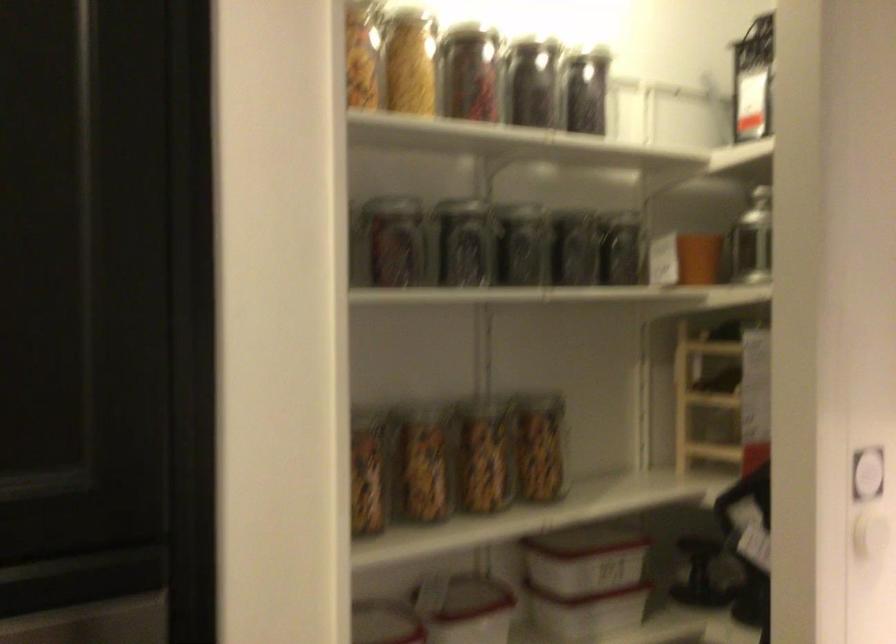
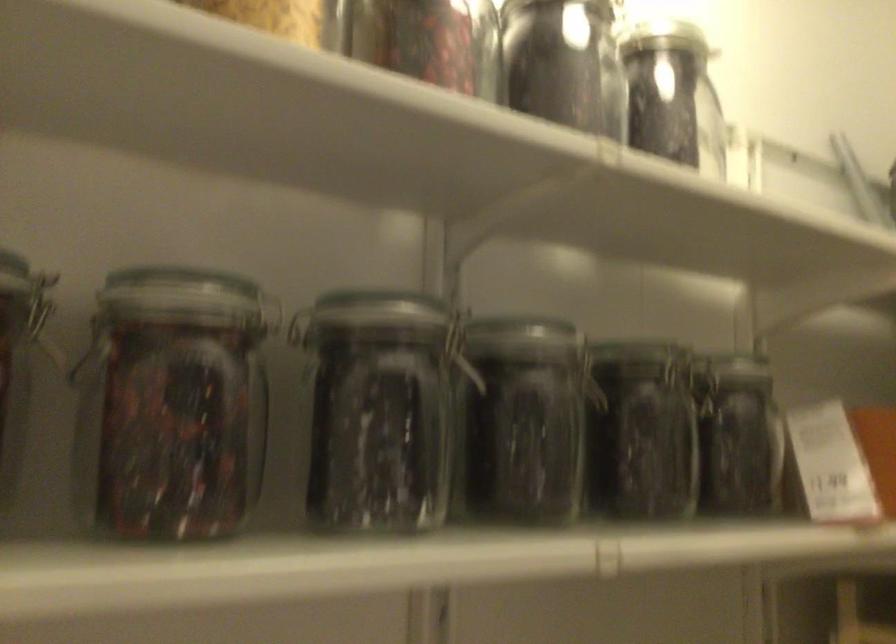
In the second image, find the point that corresponds to [400,243] in the first image.

(170, 406)